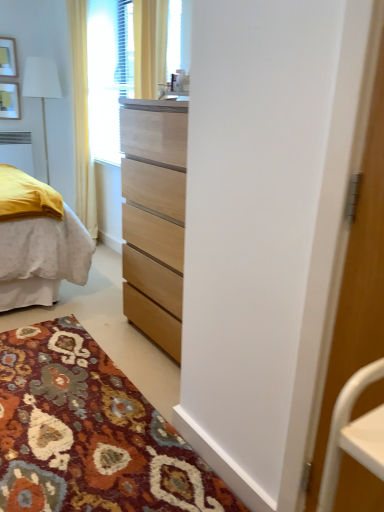
In order to click on white plastic radiator at left in this screenshot , I will do `click(17, 150)`.

What are the coordinates of `matte white picture frame at upper left, the 2th picture frame positioned from the bottom` in the screenshot? It's located at (8, 57).

Based on the photo, in order to face white fabric lampshade at left, should I rotate leftwards or rightwards?

To align with it, rotate left about 19.100°.

Find the location of a particular element. The height and width of the screenshot is (512, 384). white glossy screen door at right is located at coordinates (357, 283).

Which point is more distant from viewer, (25, 163) or (1, 44)?

Positioned behind is point (25, 163).

Is white plastic radiator at left bigger or smaller than matte white picture frame at upper left, the 2th picture frame positioned from the bottom?

Clearly, white plastic radiator at left is larger in size than matte white picture frame at upper left, the 2th picture frame positioned from the bottom.

Is matte white picture frame at upper left, the 2th picture frame positioned from the bottom, surrounded by white plastic radiator at left?

Actually, matte white picture frame at upper left, the 2th picture frame positioned from the bottom, is outside white plastic radiator at left.

Who is shorter, white plastic radiator at left or matte white picture frame at upper left, which ranks as the first picture frame in top-to-bottom order?

matte white picture frame at upper left, which ranks as the first picture frame in top-to-bottom order.

The image size is (384, 512). In the image, there is a white fabric lampshade at left. In order to click on screen door below it (from a real-world perspective) in this screenshot , I will do `click(357, 283)`.

Relative to white glossy screen door at right, is white fabric lampshade at left in front or behind?

In the image, white fabric lampshade at left appears behind white glossy screen door at right.

From the image's perspective, is white fabric lampshade at left above or below white glossy screen door at right?

white fabric lampshade at left is situated higher than white glossy screen door at right in the image.

From a real-world perspective, is white fabric lampshade at left physically below white glossy screen door at right?

No.

Is yellow fabric curtain at upper left thinner than white fabric lampshade at left?

Yes, yellow fabric curtain at upper left is thinner than white fabric lampshade at left.

What's the angular difference between yellow fabric curtain at upper left and white fabric lampshade at left's facing directions?

yellow fabric curtain at upper left and white fabric lampshade at left are facing 90 degrees away from each other.

Is point (69, 11) farther from viewer compared to point (44, 67)?

No, (69, 11) is closer to viewer.

Does yellow fabric curtain at upper left lie in front of white fabric lampshade at left?

Yes, it is.

How much distance is there between yellow fabric curtain at upper left and white glossy screen door at right?

yellow fabric curtain at upper left and white glossy screen door at right are 2.95 meters apart.

Is the position of yellow fabric curtain at upper left less distant than that of white glossy screen door at right?

No, yellow fabric curtain at upper left is further to the viewer.

Is yellow fabric curtain at upper left directly adjacent to white glossy screen door at right?

They are not placed beside each other.

Which object is thinner, yellow fabric curtain at upper left or white glossy screen door at right?

Thinner between the two is white glossy screen door at right.

Looking at this image, considering the sizes of objects white glossy screen door at right and yellow fabric curtain at upper left in the image provided, who is smaller, white glossy screen door at right or yellow fabric curtain at upper left?

Smaller between the two is white glossy screen door at right.

Is white glossy screen door at right to the left or to the right of yellow fabric curtain at upper left in the image?

white glossy screen door at right is positioned on yellow fabric curtain at upper left's right side.

Is white glossy screen door at right directly adjacent to yellow fabric curtain at upper left?

white glossy screen door at right is not next to yellow fabric curtain at upper left, and they're not touching.

From the image's perspective, who appears lower, white glossy screen door at right or yellow fabric curtain at upper left?

white glossy screen door at right.

Which is behind, point (14, 134) or point (335, 387)?

Positioned behind is point (14, 134).

Which is more to the left, white plastic radiator at left or white glossy screen door at right?

white plastic radiator at left.

From a real-world perspective, between white plastic radiator at left and white glossy screen door at right, who is vertically lower?

In real-world perspective, white plastic radiator at left is lower.

Is wooden picture frame at upper left, the first picture frame when ordered from bottom to top, completely or partially inside white glossy screen door at right?

Definitely not — wooden picture frame at upper left, the first picture frame when ordered from bottom to top, is not inside white glossy screen door at right.

What's the angular difference between white glossy screen door at right and wooden picture frame at upper left, the first picture frame when ordered from bottom to top,'s facing directions?

90 degrees separate the facing orientations of white glossy screen door at right and wooden picture frame at upper left, the first picture frame when ordered from bottom to top.

Is white glossy screen door at right taller than wooden picture frame at upper left, placed as the 2th picture frame when sorted from top to bottom?

Indeed, white glossy screen door at right has a greater height compared to wooden picture frame at upper left, placed as the 2th picture frame when sorted from top to bottom.

Locate an element on the screen. The width and height of the screenshot is (384, 512). radiator located underneath the matte white picture frame at upper left, the 2th picture frame positioned from the bottom (from a real-world perspective) is located at coordinates (17, 150).

Locate an element on the screen. The image size is (384, 512). screen door that appears in front of the white fabric lampshade at left is located at coordinates (357, 283).

When comparing their distances from white fabric lampshade at left, does yellow fabric curtain at upper left or white plastic radiator at left seem further?

Based on the image, yellow fabric curtain at upper left appears to be further to white fabric lampshade at left.

In the scene shown: From the image, which object appears to be farther from yellow fabric curtain at upper left, matte white picture frame at upper left, which ranks as the first picture frame in top-to-bottom order, or wooden picture frame at upper left, the first picture frame when ordered from bottom to top?

Among the two, matte white picture frame at upper left, which ranks as the first picture frame in top-to-bottom order, is located further to yellow fabric curtain at upper left.

Looking at the image, which one is located further to yellow fabric curtain at upper left, white plastic radiator at left or matte white picture frame at upper left, the 2th picture frame positioned from the bottom?

matte white picture frame at upper left, the 2th picture frame positioned from the bottom, is further to yellow fabric curtain at upper left.

Considering their positions, is white glossy screen door at right positioned further to matte white picture frame at upper left, the 2th picture frame positioned from the bottom, than yellow fabric curtain at upper left?

The object further to matte white picture frame at upper left, the 2th picture frame positioned from the bottom, is white glossy screen door at right.

Estimate the real-world distances between objects in this image. Which object is further from white glossy screen door at right, wooden picture frame at upper left, placed as the 2th picture frame when sorted from top to bottom, or matte white picture frame at upper left, which ranks as the first picture frame in top-to-bottom order?

Among the two, matte white picture frame at upper left, which ranks as the first picture frame in top-to-bottom order, is located further to white glossy screen door at right.

Based on their spatial positions, is yellow fabric curtain at upper left or white glossy screen door at right closer to matte white picture frame at upper left, which ranks as the first picture frame in top-to-bottom order?

Based on the image, yellow fabric curtain at upper left appears to be nearer to matte white picture frame at upper left, which ranks as the first picture frame in top-to-bottom order.

Looking at the image, which one is located closer to white plastic radiator at left, matte white picture frame at upper left, the 2th picture frame positioned from the bottom, or white glossy screen door at right?

matte white picture frame at upper left, the 2th picture frame positioned from the bottom, is closer to white plastic radiator at left.

Based on their spatial positions, is white fabric lampshade at left or white plastic radiator at left further from white glossy screen door at right?

white fabric lampshade at left is positioned further to the anchor white glossy screen door at right.

You are a GUI agent. You are given a task and a screenshot of the screen. Output one action in this format:
    pyautogui.click(x=<x>, y=<y>)
    Task: Click on the curtain between white glossy screen door at right and white fabric lampshade at left in the front-back direction
    This screenshot has height=512, width=384.
    Given the screenshot: What is the action you would take?
    pyautogui.click(x=81, y=117)

The image size is (384, 512). Find the location of `table lamp between wooden picture frame at upper left, the first picture frame when ordered from bottom to top, and white plastic radiator at left vertically`. table lamp between wooden picture frame at upper left, the first picture frame when ordered from bottom to top, and white plastic radiator at left vertically is located at coordinates (41, 89).

Where is `picture frame between matte white picture frame at upper left, which ranks as the first picture frame in top-to-bottom order, and white plastic radiator at left in the up-down direction`? The image size is (384, 512). picture frame between matte white picture frame at upper left, which ranks as the first picture frame in top-to-bottom order, and white plastic radiator at left in the up-down direction is located at coordinates (9, 101).

The image size is (384, 512). In order to click on table lamp located between white glossy screen door at right and wooden picture frame at upper left, the first picture frame when ordered from bottom to top, in the depth direction in this screenshot , I will do `click(41, 89)`.